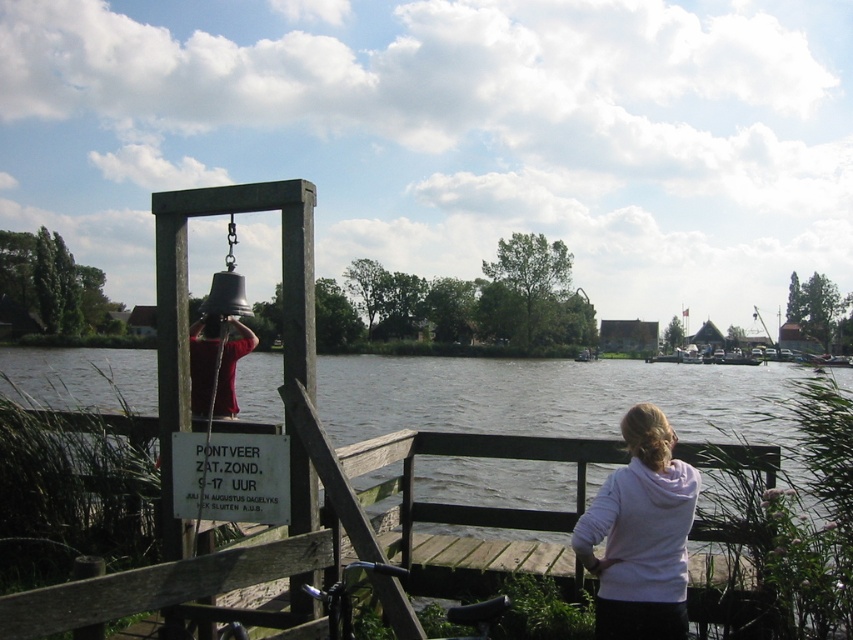
You are a tourist visiting the riverside and want to find the white fleece jacket at lower right. According to the scene description, where should you look to locate it?

The white fleece jacket at lower right is located at point (641,534).

You are a visitor at this riverside location and want to take a photo of the wooden at center and dark gray plastic sign at lower center. Which object should you focus on first if you want to ensure both are in the frame without moving the camera?

The wooden at center is much taller than the dark gray plastic sign at lower center, so you should focus on the wooden at center first to ensure both are in the frame without moving the camera.